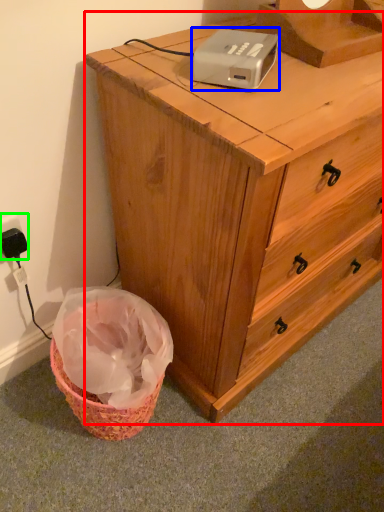
Question: Which is farther away from chest of drawers (highlighted by a red box)? gadget (highlighted by a blue box) or electric outlet (highlighted by a green box)?

Choices:
 (A) gadget
 (B) electric outlet

Answer: (B)